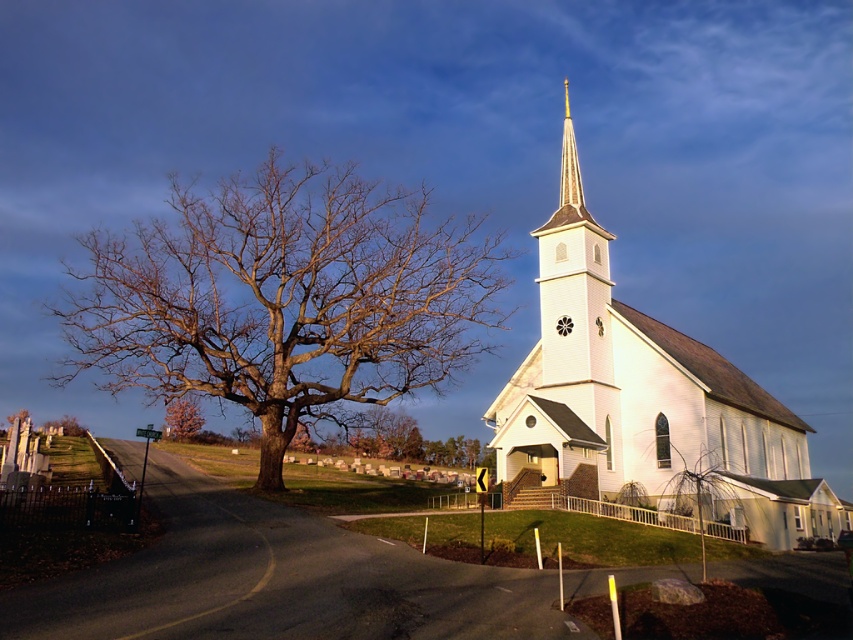
Question: Which is farther from the white wood church at center?

Choices:
 (A) shiny gold spire at upper center
 (B) bare wood tree at left
 (C) pink textured tree at lower left

Answer: (C)

Question: Which is farther from the shiny gold spire at upper center?

Choices:
 (A) bare wood tree at left
 (B) pink textured tree at lower left
 (C) white wood church at center

Answer: (B)

Question: Which is nearer to the pink textured tree at lower left?

Choices:
 (A) shiny gold spire at upper center
 (B) bare wood tree at left

Answer: (B)

Question: Observing the image, what is the correct spatial positioning of bare wood tree at left in reference to shiny gold spire at upper center?

Choices:
 (A) right
 (B) left

Answer: (B)

Question: Can you confirm if bare wood tree at left is wider than white wood church at center?

Choices:
 (A) no
 (B) yes

Answer: (B)

Question: In this image, where is white wood church at center located relative to pink textured tree at lower left?

Choices:
 (A) right
 (B) left

Answer: (A)